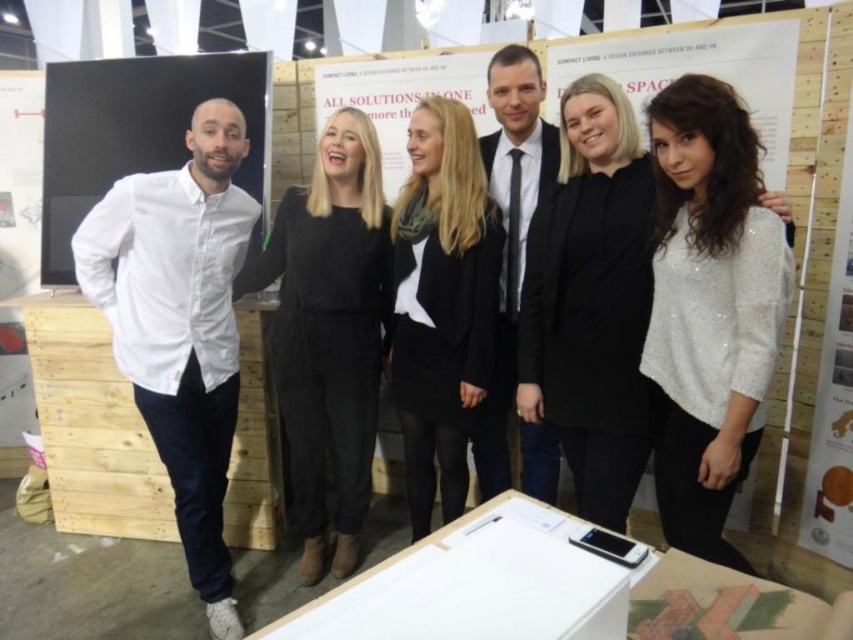
Between point (457, 189) and point (538, 74), which one is positioned behind?

Positioned behind is point (538, 74).

Which is behind, point (451, 100) or point (508, 262)?

The point (508, 262) is more distant.

I want to click on black matte blazer at center, so click(x=440, y=304).

Which of these two, black matte blazer at center or matte black board at left, stands shorter?

matte black board at left is shorter.

Can you confirm if black matte blazer at center is positioned below matte black board at left?

Indeed, black matte blazer at center is positioned under matte black board at left.

What do you see at coordinates (440, 304) in the screenshot? This screenshot has width=853, height=640. I see `black matte blazer at center` at bounding box center [440, 304].

Where is `black matte blazer at center`? black matte blazer at center is located at coordinates (440, 304).

Can you confirm if white sequined sweater at center is positioned above black jersey at center?

Correct, white sequined sweater at center is located above black jersey at center.

Is white sequined sweater at center closer to camera compared to black jersey at center?

That is True.

Which is behind, point (547, 401) or point (296, 236)?

The point (296, 236) is behind.

This screenshot has height=640, width=853. Find the location of `white sequined sweater at center`. white sequined sweater at center is located at coordinates (590, 300).